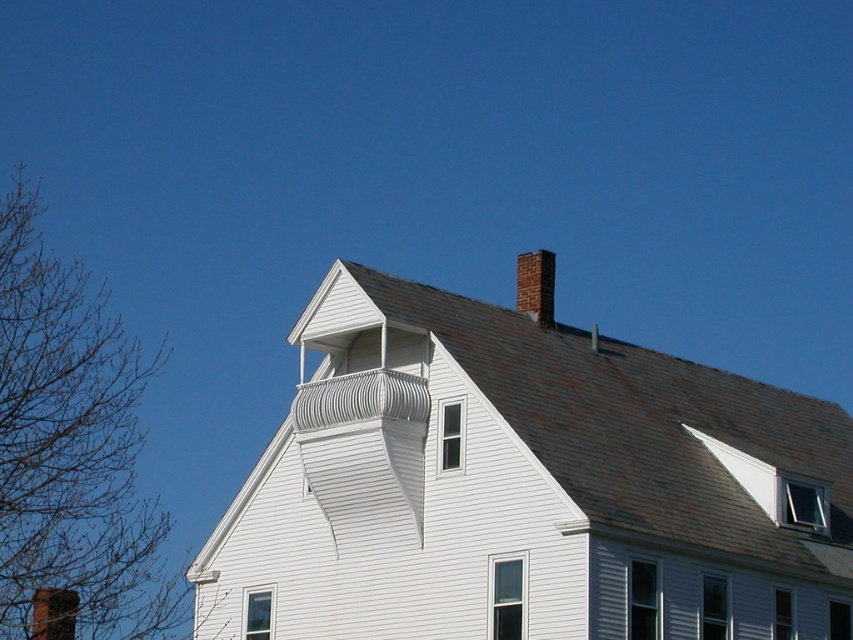
Question: Among these objects, which one is farthest from the camera?

Choices:
 (A) brick chimney at upper right
 (B) bare branches at left

Answer: (B)

Question: Can you confirm if brick chimney at upper right is positioned below brown brick chimney at upper center?

Choices:
 (A) no
 (B) yes

Answer: (A)

Question: Does brick chimney at upper right come behind brown brick chimney at upper center?

Choices:
 (A) no
 (B) yes

Answer: (A)

Question: Which object appears closest to the camera in this image?

Choices:
 (A) brown brick chimney at upper center
 (B) bare branches at left
 (C) brick chimney at upper right

Answer: (C)

Question: Which of the following is the closest to the observer?

Choices:
 (A) bare branches at left
 (B) brick chimney at upper right

Answer: (B)

Question: Can you confirm if bare branches at left is thinner than brown brick chimney at upper center?

Choices:
 (A) no
 (B) yes

Answer: (A)